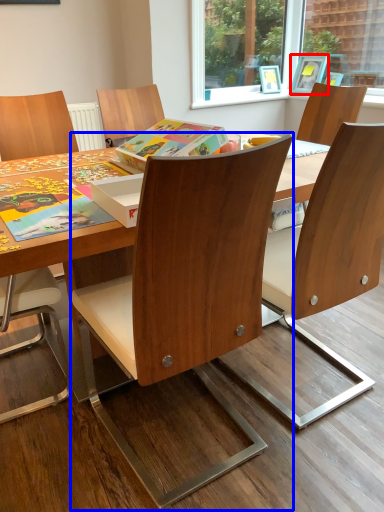
Question: Among these objects, which one is nearest to the camera, picture frame (highlighted by a red box) or chair (highlighted by a blue box)?

Choices:
 (A) picture frame
 (B) chair

Answer: (B)